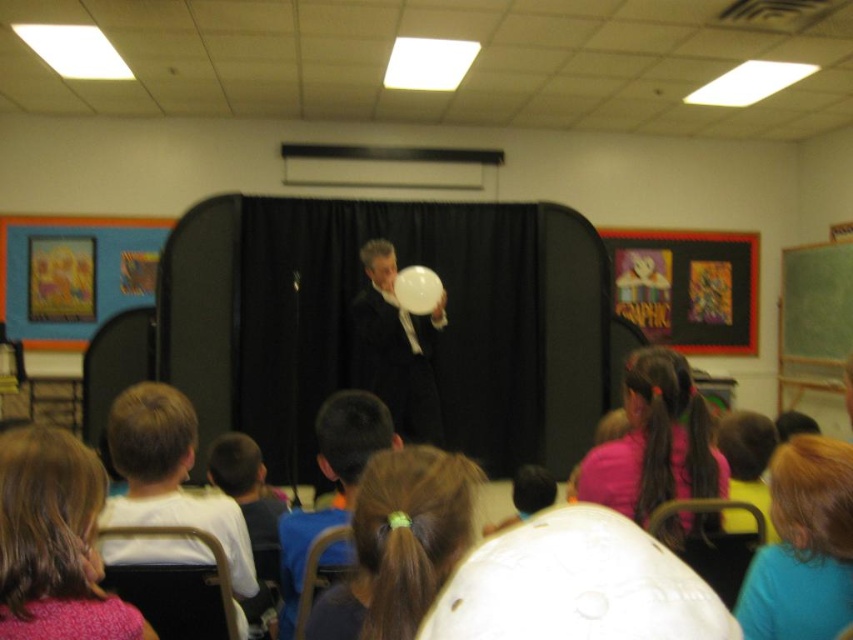
You are a student sitting in the front row of the classroom. You notice two items at the center of your view. Which one is wider, the pink fabric ponytail at center or the white glossy balloon at center?

The white glossy balloon at center is wider than the pink fabric ponytail at center.

Looking at this image, you are sitting in the classroom and want to determine which of the two points, point (808, 486) or point (389, 276), is nearer to you. Based on the scene, which point is closer?

Point (808, 486) is closer to the viewer than point (389, 276).